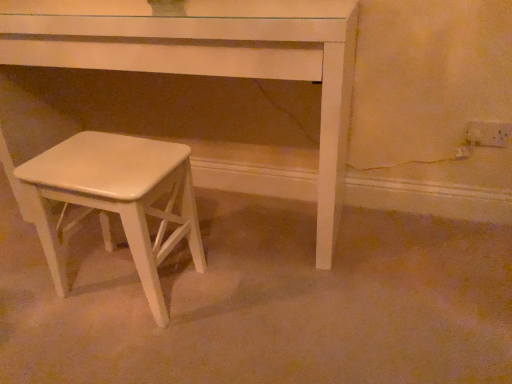
Question: Is white wood stool at lower left smaller than white glossy stool at lower left?

Choices:
 (A) yes
 (B) no

Answer: (B)

Question: Is white wood stool at lower left taller than white glossy stool at lower left?

Choices:
 (A) yes
 (B) no

Answer: (A)

Question: Is the position of white wood stool at lower left less distant than that of white glossy stool at lower left?

Choices:
 (A) yes
 (B) no

Answer: (B)

Question: Would you say white wood stool at lower left contains white glossy stool at lower left?

Choices:
 (A) no
 (B) yes

Answer: (A)

Question: Can you confirm if white wood stool at lower left is positioned to the left of white glossy stool at lower left?

Choices:
 (A) yes
 (B) no

Answer: (B)

Question: Considering the relative sizes of white wood stool at lower left and white glossy stool at lower left in the image provided, is white wood stool at lower left shorter than white glossy stool at lower left?

Choices:
 (A) yes
 (B) no

Answer: (B)

Question: Is white glossy stool at lower left shorter than white wood stool at lower left?

Choices:
 (A) yes
 (B) no

Answer: (A)

Question: Is white glossy stool at lower left to the left of white wood stool at lower left from the viewer's perspective?

Choices:
 (A) no
 (B) yes

Answer: (B)

Question: Is white glossy stool at lower left smaller than white wood stool at lower left?

Choices:
 (A) no
 (B) yes

Answer: (B)

Question: From the image's perspective, would you say white glossy stool at lower left is shown under white wood stool at lower left?

Choices:
 (A) no
 (B) yes

Answer: (B)

Question: Is white glossy stool at lower left wider than white wood stool at lower left?

Choices:
 (A) yes
 (B) no

Answer: (B)

Question: Does white glossy stool at lower left have a larger size compared to white wood stool at lower left?

Choices:
 (A) yes
 (B) no

Answer: (B)

Question: Is white wood stool at lower left bigger or smaller than white glossy stool at lower left?

Choices:
 (A) big
 (B) small

Answer: (A)